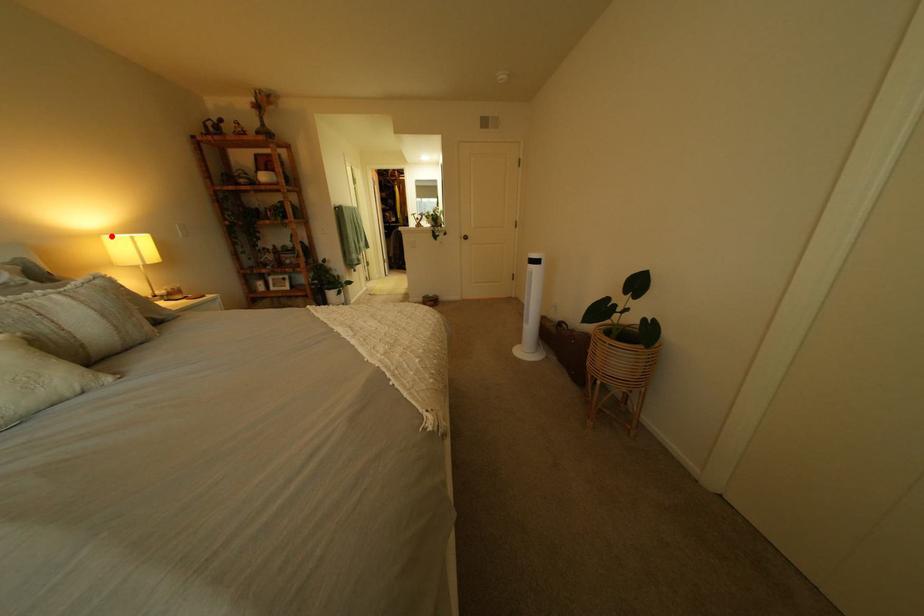
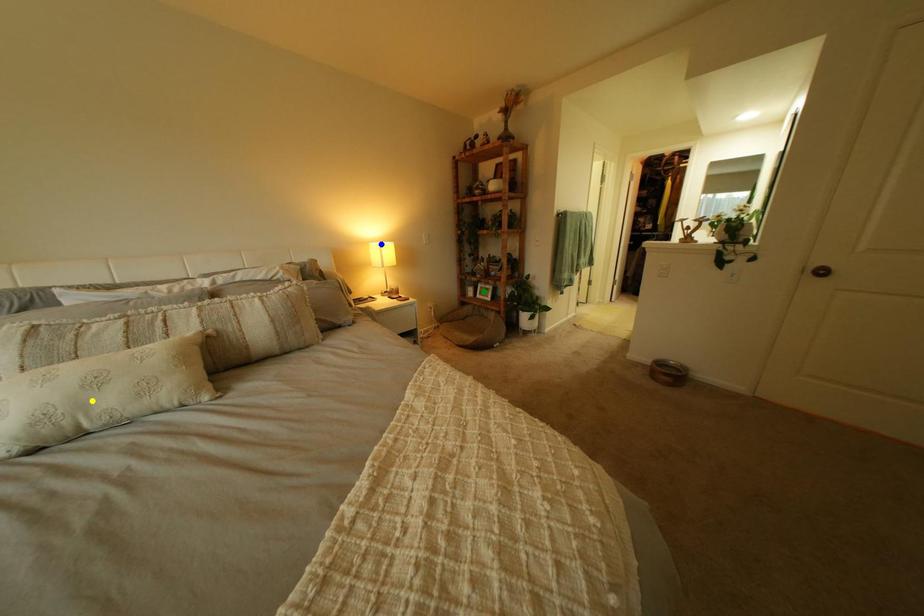
Question: I am providing you with two images of the same scene from different viewpoints. A red point is marked on the first image. You are given multiple points on the second image. Which spot in image 2 lines up with the point in image 1?

Choices:
 (A) yellow point
 (B) green point
 (C) blue point

Answer: (C)